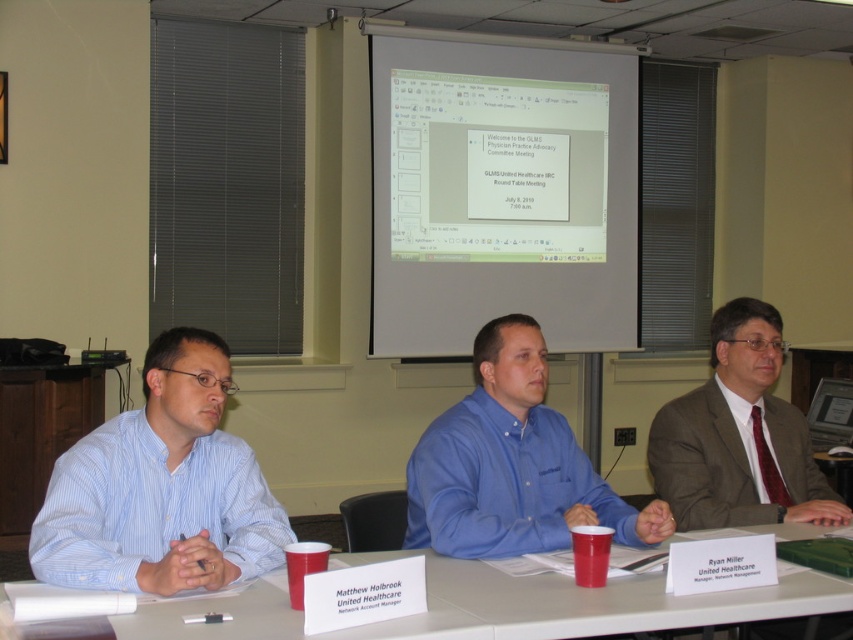
You are attending a meeting and need to determine seating arrangements based on height. Which attendee is shorter between the blue striped shirt at left and the matte brown suit at right?

The blue striped shirt at left is shorter than the matte brown suit at right.

You are organizing a team photo and need to arrange the participants based on their clothing sizes. Given that you have the blue striped shirt at left and the matte brown suit at right, which clothing item should be placed on the left side to maintain size order from smallest to largest?

The blue striped shirt at left should be placed on the left side since it has a smaller size compared to the matte brown suit at right.

You are organizing a meeting and need to place a new document on the table. The document is the same size as the white paper at center. Can you place it next to the matte brown suit at right without overlapping?

The white paper at center occupies less space than the matte brown suit at right, so placing the new document next to the matte brown suit at right may be possible as there might be enough space. However, since the white paper is smaller, the exact available space isn